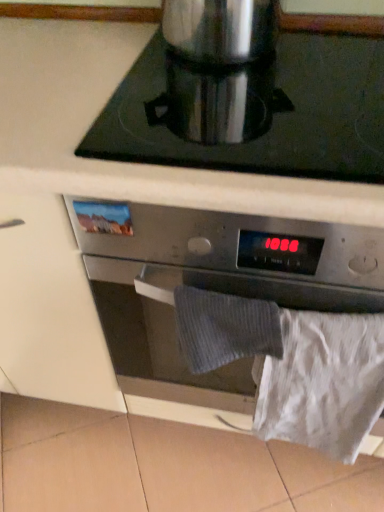
The image size is (384, 512). What do you see at coordinates (212, 283) in the screenshot?
I see `satin silver oven at center` at bounding box center [212, 283].

The image size is (384, 512). Describe the element at coordinates (267, 115) in the screenshot. I see `silver metallic pot at upper center` at that location.

The image size is (384, 512). What do you see at coordinates (220, 29) in the screenshot? I see `satin silver coffee pot at upper center` at bounding box center [220, 29].

Image resolution: width=384 pixels, height=512 pixels. In order to click on satin silver oven at center in this screenshot , I will do `click(212, 283)`.

Would you consider white paper at lower right to be distant from satin silver oven at center?

No, there isn't a large distance between white paper at lower right and satin silver oven at center.

Based on the photo, can you confirm if white paper at lower right is thinner than satin silver oven at center?

Yes.

Considering the sizes of objects silver metallic pot at upper center and satin silver oven at center in the image provided, who is taller, silver metallic pot at upper center or satin silver oven at center?

With more height is satin silver oven at center.

In the scene shown: Does silver metallic pot at upper center have a greater width compared to satin silver oven at center?

Incorrect, the width of silver metallic pot at upper center does not surpass that of satin silver oven at center.

Considering the relative sizes of silver metallic pot at upper center and satin silver oven at center in the image provided, is silver metallic pot at upper center bigger than satin silver oven at center?

No, silver metallic pot at upper center is not bigger than satin silver oven at center.

From a real-world perspective, is silver metallic pot at upper center above or below satin silver oven at center?

In terms of real-world spatial position, silver metallic pot at upper center is above satin silver oven at center.

Looking at their sizes, would you say satin silver oven at center is wider or thinner than white paper at lower right?

Clearly, satin silver oven at center has more width compared to white paper at lower right.

From a real-world perspective, is satin silver oven at center under white paper at lower right?

Incorrect, from a real-world perspective, satin silver oven at center is higher than white paper at lower right.

Is satin silver oven at center positioned before white paper at lower right?

Yes, satin silver oven at center is closer to the viewer.

Is satin silver oven at center at the left side of white paper at lower right?

Yes.

Is white paper at lower right inside or outside of satin silver coffee pot at upper center?

white paper at lower right exists outside the volume of satin silver coffee pot at upper center.

Between white paper at lower right and satin silver coffee pot at upper center, which one has smaller size?

Smaller between the two is satin silver coffee pot at upper center.

Considering the sizes of white paper at lower right and satin silver coffee pot at upper center in the image, is white paper at lower right wider or thinner than satin silver coffee pot at upper center?

Considering their sizes, white paper at lower right looks slimmer than satin silver coffee pot at upper center.

From the picture: From a real-world perspective, which object stands above the other?

From a 3D spatial view, satin silver coffee pot at upper center is above.

From the image's perspective, is satin silver coffee pot at upper center beneath silver metallic pot at upper center?

No.

Can we say satin silver coffee pot at upper center lies outside silver metallic pot at upper center?

satin silver coffee pot at upper center lies outside silver metallic pot at upper center's area.

Looking at this image, is satin silver coffee pot at upper center looking in the opposite direction of silver metallic pot at upper center?

No, satin silver coffee pot at upper center is not facing away from silver metallic pot at upper center.

Considering the sizes of objects satin silver coffee pot at upper center and silver metallic pot at upper center in the image provided, who is taller, satin silver coffee pot at upper center or silver metallic pot at upper center?

satin silver coffee pot at upper center is taller.

Which of these two, satin silver oven at center or silver metallic pot at upper center, is smaller?

silver metallic pot at upper center.

From the image's perspective, is satin silver oven at center below silver metallic pot at upper center?

Yes, from the image's perspective, satin silver oven at center is below silver metallic pot at upper center.

Which object is positioned more to the left, satin silver oven at center or silver metallic pot at upper center?

Positioned to the left is silver metallic pot at upper center.

Is satin silver oven at center wider or thinner than silver metallic pot at upper center?

In the image, satin silver oven at center appears to be wider than silver metallic pot at upper center.

Does satin silver oven at center have a larger size compared to satin silver coffee pot at upper center?

Indeed, satin silver oven at center has a larger size compared to satin silver coffee pot at upper center.

Considering their positions, is satin silver oven at center located in front of or behind satin silver coffee pot at upper center?

Visually, satin silver oven at center is located in front of satin silver coffee pot at upper center.

Is satin silver oven at center turned away from satin silver coffee pot at upper center?

satin silver oven at center does not have its back to satin silver coffee pot at upper center.

Between satin silver oven at center and satin silver coffee pot at upper center, which one appears on the left side from the viewer's perspective?

satin silver coffee pot at upper center.

What are the coordinates of `sheet located underneath the satin silver oven at center (from a real-world perspective)` in the screenshot? It's located at (322, 382).

In order to click on gas stove that appears on the left of satin silver oven at center in this screenshot , I will do `click(267, 115)`.

Considering their positions, is silver metallic pot at upper center positioned closer to white paper at lower right than satin silver coffee pot at upper center?

silver metallic pot at upper center is positioned closer to the anchor white paper at lower right.

Looking at the image, which one is located closer to satin silver oven at center, satin silver coffee pot at upper center or silver metallic pot at upper center?

silver metallic pot at upper center is positioned closer to the anchor satin silver oven at center.

Based on their spatial positions, is satin silver oven at center or silver metallic pot at upper center further from satin silver coffee pot at upper center?

satin silver oven at center is positioned further to the anchor satin silver coffee pot at upper center.

Which object lies further to the anchor point silver metallic pot at upper center, satin silver coffee pot at upper center or satin silver oven at center?

The object further to silver metallic pot at upper center is satin silver oven at center.

Estimate the real-world distances between objects in this image. Which object is further from satin silver oven at center, white paper at lower right or satin silver coffee pot at upper center?

Among the two, satin silver coffee pot at upper center is located further to satin silver oven at center.

Looking at the image, which one is located further to white paper at lower right, satin silver coffee pot at upper center or silver metallic pot at upper center?

The object further to white paper at lower right is satin silver coffee pot at upper center.

Estimate the real-world distances between objects in this image. Which object is closer to silver metallic pot at upper center, white paper at lower right or satin silver oven at center?

Among the two, satin silver oven at center is located nearer to silver metallic pot at upper center.

Based on their spatial positions, is satin silver coffee pot at upper center or satin silver oven at center further from white paper at lower right?

The object further to white paper at lower right is satin silver coffee pot at upper center.

Identify the location of gas stove between satin silver coffee pot at upper center and satin silver oven at center vertically. (267, 115).

Image resolution: width=384 pixels, height=512 pixels. In order to click on kitchen appliance between satin silver coffee pot at upper center and white paper at lower right in the vertical direction in this screenshot , I will do `click(212, 283)`.

The image size is (384, 512). I want to click on gas stove between satin silver coffee pot at upper center and white paper at lower right in the vertical direction, so (x=267, y=115).

Image resolution: width=384 pixels, height=512 pixels. In order to click on kitchen appliance between silver metallic pot at upper center and white paper at lower right from top to bottom in this screenshot , I will do `click(212, 283)`.